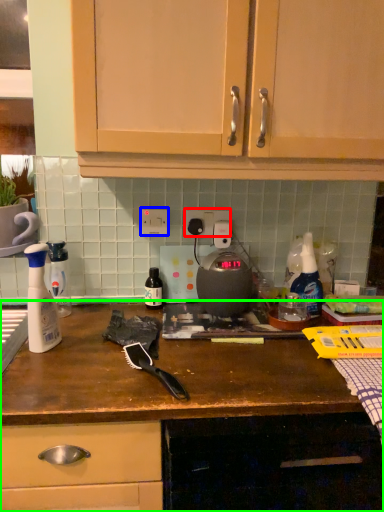
Question: Which object is the closest to the electric outlet (highlighted by a red box)? Choose among these: electric outlet (highlighted by a blue box) or cabinetry (highlighted by a green box).

Choices:
 (A) electric outlet
 (B) cabinetry

Answer: (A)